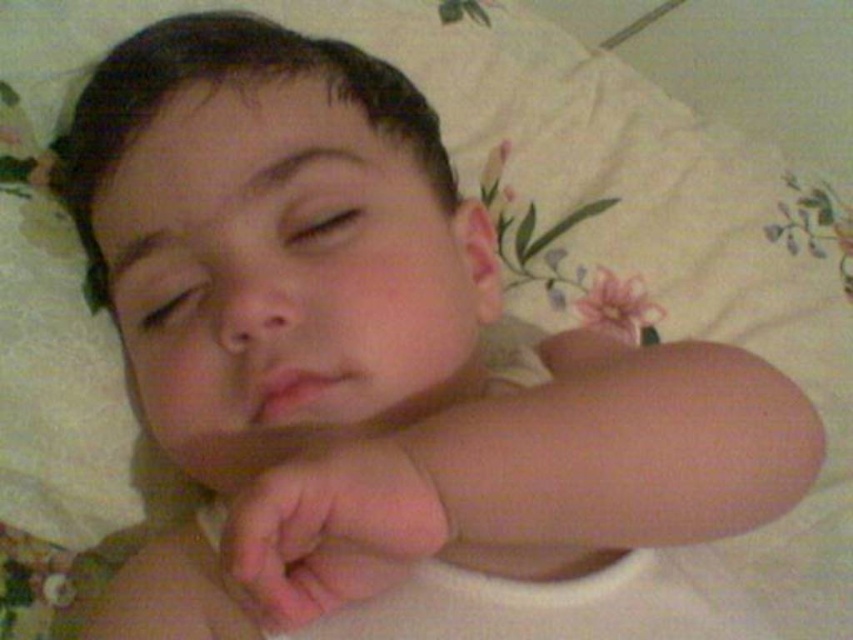
Which is below, smooth skin baby at center or pink flesh at center?

pink flesh at center is lower down.

Can you confirm if smooth skin baby at center is thinner than pink flesh at center?

No, smooth skin baby at center is not thinner than pink flesh at center.

Does point (236, 228) come farther from viewer compared to point (393, 477)?

Yes, it is.

Image resolution: width=853 pixels, height=640 pixels. What are the coordinates of `smooth skin baby at center` in the screenshot? It's located at (273, 237).

Does pink smooth skin at center appear on the right side of pink flesh at center?

Yes, pink smooth skin at center is to the right of pink flesh at center.

Who is lower down, pink smooth skin at center or pink flesh at center?

Positioned lower is pink smooth skin at center.

This screenshot has height=640, width=853. Identify the location of pink smooth skin at center. (531, 474).

Which is in front, point (440, 337) or point (293, 524)?

Positioned in front is point (293, 524).

Is smooth skin baby at center positioned behind pink smooth skin at center?

That is True.

Between point (434, 257) and point (381, 452), which one is positioned in front?

Point (381, 452)

Find the location of `smooth skin baby at center`. smooth skin baby at center is located at coordinates (273, 237).